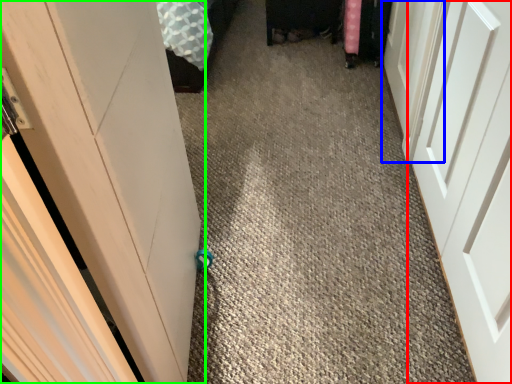
Question: Which is farther away from door (highlighted by a red box)? door (highlighted by a blue box) or door (highlighted by a green box)?

Choices:
 (A) door
 (B) door

Answer: (B)